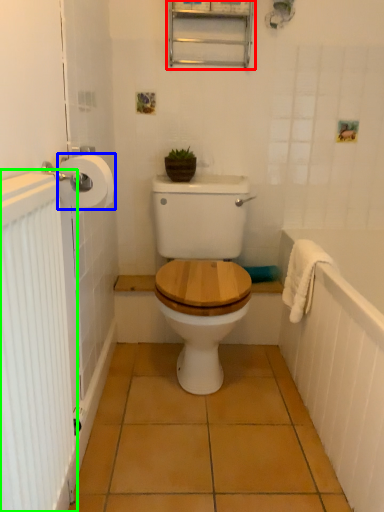
Question: Based on their relative distances, which object is nearer to medicine cabinet (highlighted by a red box)? Choose from toilet paper (highlighted by a blue box) and radiator (highlighted by a green box).

Choices:
 (A) toilet paper
 (B) radiator

Answer: (A)